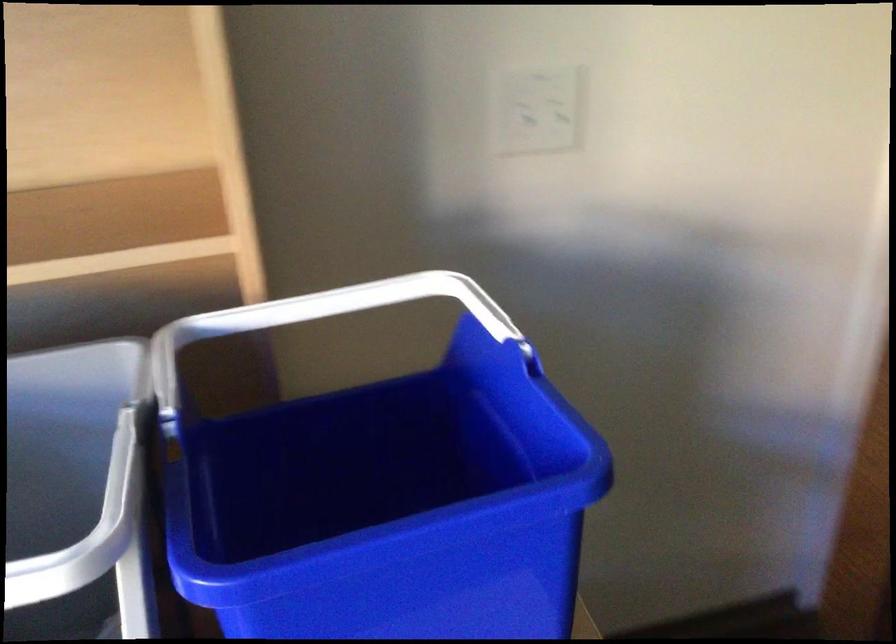
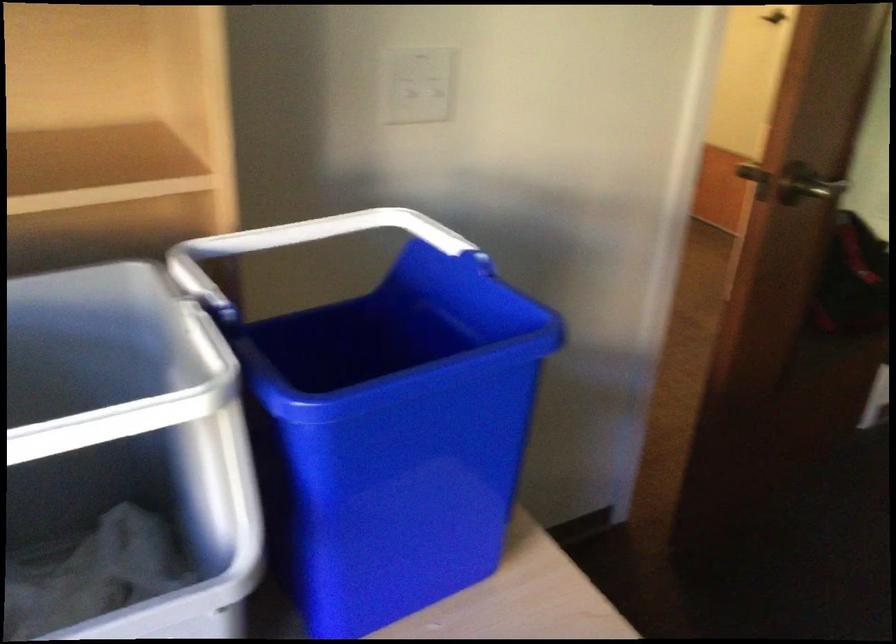
Locate, in the second image, the point that corresponds to (x=224, y=335) in the first image.

(213, 257)